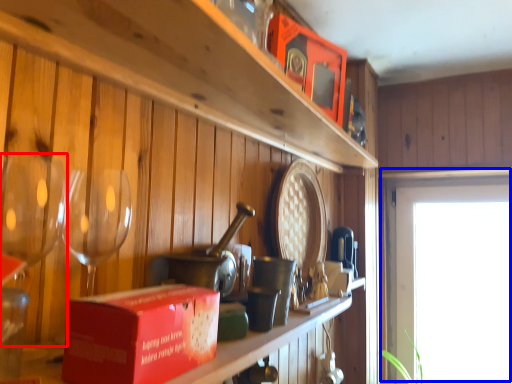
Question: Which object is closer to the camera taking this photo, wine glass (highlighted by a red box) or window (highlighted by a blue box)?

Choices:
 (A) wine glass
 (B) window

Answer: (A)